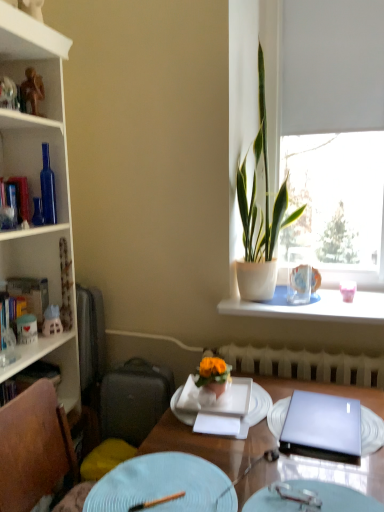
Identify the location of vacant space that's between satin purple laptop at center and white paper at center. (260, 424).